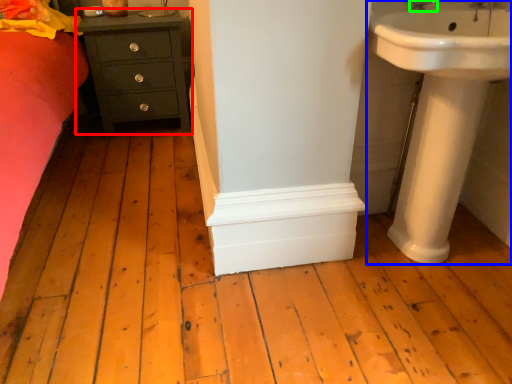
Question: Considering the real-world distances, which object is farthest from chest of drawers (highlighted by a red box)? sink (highlighted by a blue box) or tap (highlighted by a green box)?

Choices:
 (A) sink
 (B) tap

Answer: (B)